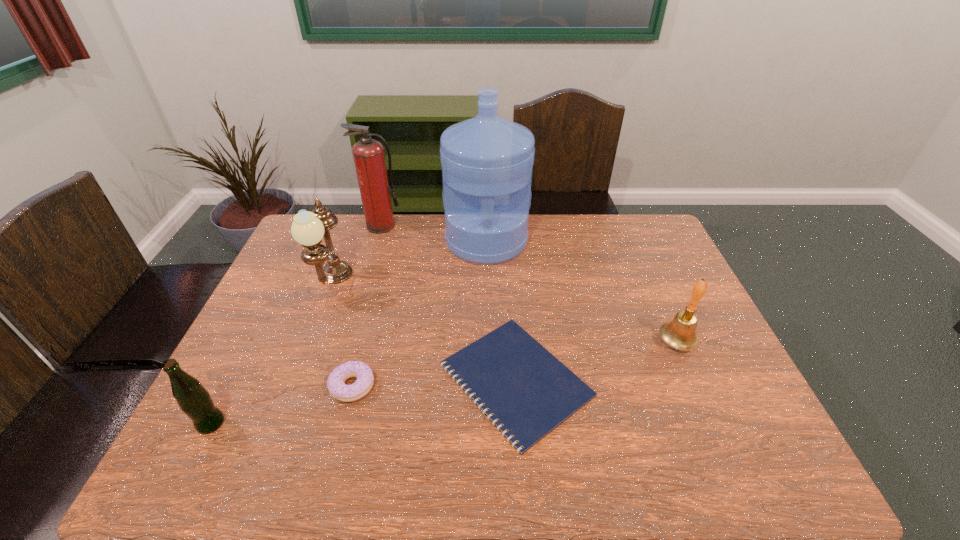
The image size is (960, 540). Identify the location of free space at the far edge of the desktop. (606, 231).

This screenshot has width=960, height=540. Find the location of `vacant space at the near edge`. vacant space at the near edge is located at coordinates click(x=591, y=468).

Find the location of a particular element. This screenshot has height=540, width=960. free space at the right edge of the desktop is located at coordinates (663, 315).

What are the coordinates of `vacant region at the near left corner of the desktop` in the screenshot? It's located at (251, 445).

In the image, there is a desktop. Identify the location of vacant space at the near right corner. This screenshot has height=540, width=960. (756, 480).

At what (x,y) coordinates should I click in order to perform the action: click on free space that is in between the second shortest object and the shortest object. Please return your answer as a coordinate pair (x, y). Image resolution: width=960 pixels, height=540 pixels. Looking at the image, I should click on click(x=435, y=383).

In order to click on free spot between the rightmost object and the shortest object in this screenshot , I will do `click(596, 361)`.

Where is `empty location between the shortest object and the rightmost object`? empty location between the shortest object and the rightmost object is located at coordinates (596, 361).

Find the location of a particular element. This screenshot has width=960, height=540. free point between the second tallest object and the oil lamp is located at coordinates (357, 255).

Identify the location of free point between the third tallest object and the leftmost object. (272, 354).